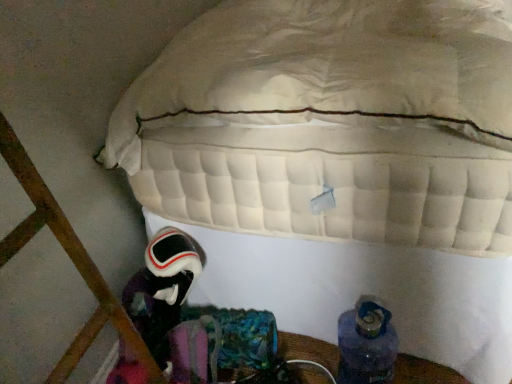
What do you see at coordinates (162, 289) in the screenshot? I see `velvet-like black astronaut at lower left` at bounding box center [162, 289].

You are a GUI agent. You are given a task and a screenshot of the screen. Output one action in this format:
    pyautogui.click(x=<x>, y=<y>)
    Task: Click on the velvet-like black astronaut at lower left
    The image size is (512, 384).
    Given the screenshot: What is the action you would take?
    pyautogui.click(x=162, y=289)

Where is `blue fabric boot at lower right`? The image size is (512, 384). blue fabric boot at lower right is located at coordinates (366, 345).

This screenshot has height=384, width=512. What do you see at coordinates (366, 345) in the screenshot?
I see `blue fabric boot at lower right` at bounding box center [366, 345].

You are a GUI agent. You are given a task and a screenshot of the screen. Output one action in this format:
    pyautogui.click(x=<x>, y=<y>)
    Task: Click on the velvet-like black astronaut at lower left
    The height and width of the screenshot is (384, 512).
    Given the screenshot: What is the action you would take?
    pyautogui.click(x=162, y=289)

Is velvet-like black astronaut at lower left to the left or to the right of blue fabric boot at lower right in the image?

Based on their positions, velvet-like black astronaut at lower left is located to the left of blue fabric boot at lower right.

Based on the photo, which is in front, velvet-like black astronaut at lower left or blue fabric boot at lower right?

blue fabric boot at lower right is in front.

Between point (142, 291) and point (338, 366), which one is positioned in front?

The point (142, 291) is more forward.

From the image's perspective, is velvet-like black astronaut at lower left under blue fabric boot at lower right?

Actually, velvet-like black astronaut at lower left appears above blue fabric boot at lower right in the image.

From a real-world perspective, is velvet-like black astronaut at lower left physically located above or below blue fabric boot at lower right?

velvet-like black astronaut at lower left is above blue fabric boot at lower right.

Looking at their sizes, would you say velvet-like black astronaut at lower left is wider or thinner than blue fabric boot at lower right?

Clearly, velvet-like black astronaut at lower left has more width compared to blue fabric boot at lower right.

Between velvet-like black astronaut at lower left and blue fabric boot at lower right, which one has more height?

With more height is velvet-like black astronaut at lower left.

Considering the sizes of objects velvet-like black astronaut at lower left and blue fabric boot at lower right in the image provided, who is bigger, velvet-like black astronaut at lower left or blue fabric boot at lower right?

velvet-like black astronaut at lower left is bigger.

Can we say velvet-like black astronaut at lower left lies outside blue fabric boot at lower right?

velvet-like black astronaut at lower left lies outside blue fabric boot at lower right's area.

Does velvet-like black astronaut at lower left touch blue fabric boot at lower right?

No, velvet-like black astronaut at lower left is not touching blue fabric boot at lower right.

Is velvet-like black astronaut at lower left facing towards blue fabric boot at lower right?

No, velvet-like black astronaut at lower left is not aimed at blue fabric boot at lower right.

How different are the orientations of velvet-like black astronaut at lower left and blue fabric boot at lower right in degrees?

velvet-like black astronaut at lower left and blue fabric boot at lower right are facing 0.000903 degrees away from each other.

The width and height of the screenshot is (512, 384). Identify the location of footwear below the velvet-like black astronaut at lower left (from the image's perspective). (366, 345).

Is blue fabric boot at lower right to the right of velvet-like black astronaut at lower left from the viewer's perspective?

Correct, you'll find blue fabric boot at lower right to the right of velvet-like black astronaut at lower left.

Is the position of blue fabric boot at lower right more distant than that of velvet-like black astronaut at lower left?

No, blue fabric boot at lower right is closer to the viewer.

Considering the points (345, 364) and (123, 356), which point is behind, point (345, 364) or point (123, 356)?

The point (345, 364) is more distant.

From the image's perspective, is blue fabric boot at lower right over velvet-like black astronaut at lower left?

Actually, blue fabric boot at lower right appears below velvet-like black astronaut at lower left in the image.

From a real-world perspective, which is physically above, blue fabric boot at lower right or velvet-like black astronaut at lower left?

velvet-like black astronaut at lower left is physically above.

In the scene shown: Considering the relative sizes of blue fabric boot at lower right and velvet-like black astronaut at lower left in the image provided, is blue fabric boot at lower right wider than velvet-like black astronaut at lower left?

No, blue fabric boot at lower right is not wider than velvet-like black astronaut at lower left.

Who is taller, blue fabric boot at lower right or velvet-like black astronaut at lower left?

With more height is velvet-like black astronaut at lower left.

Can you confirm if blue fabric boot at lower right is bigger than velvet-like black astronaut at lower left?

No, blue fabric boot at lower right is not bigger than velvet-like black astronaut at lower left.

Can we say blue fabric boot at lower right lies outside velvet-like black astronaut at lower left?

Yes, blue fabric boot at lower right is not within velvet-like black astronaut at lower left.

Are blue fabric boot at lower right and velvet-like black astronaut at lower left far apart?

blue fabric boot at lower right is actually quite close to velvet-like black astronaut at lower left.

Is blue fabric boot at lower right turned away from velvet-like black astronaut at lower left?

No, blue fabric boot at lower right is not facing away from velvet-like black astronaut at lower left.

What's the angular difference between blue fabric boot at lower right and velvet-like black astronaut at lower left's facing directions?

The angle between the facing direction of blue fabric boot at lower right and the facing direction of velvet-like black astronaut at lower left is 0.000903 degrees.

Find the location of a particular element. The width and height of the screenshot is (512, 384). astronaut that appears on the left of blue fabric boot at lower right is located at coordinates (162, 289).

The height and width of the screenshot is (384, 512). I want to click on footwear on the right of velvet-like black astronaut at lower left, so click(366, 345).

Where is `astronaut that appears behind the blue fabric boot at lower right`? This screenshot has height=384, width=512. astronaut that appears behind the blue fabric boot at lower right is located at coordinates (162, 289).